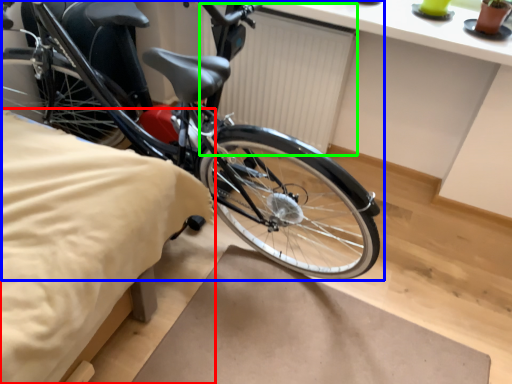
Question: Which is nearer to the sheet (highlighted by a red box)? bicycle (highlighted by a blue box) or radiator (highlighted by a green box).

Choices:
 (A) bicycle
 (B) radiator

Answer: (A)